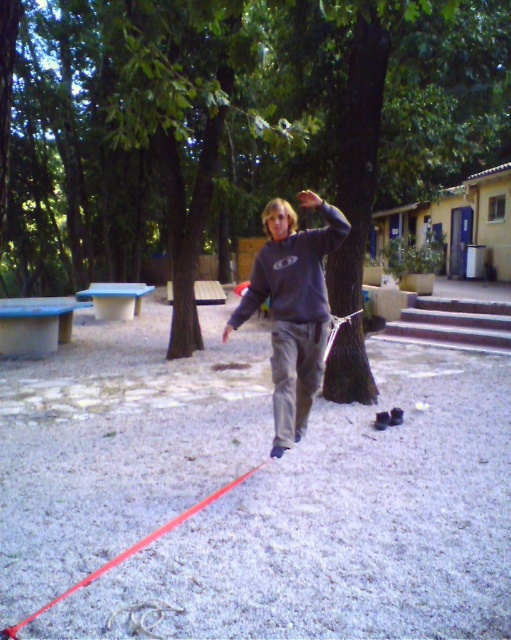
Between dark gray sweatshirt at center and matte gray sweatshirt at center, which one has more height?

With more height is dark gray sweatshirt at center.

Is dark gray sweatshirt at center wider than matte gray sweatshirt at center?

No.

Between point (303, 198) and point (268, 257), which one is positioned behind?

Point (268, 257)

Identify the location of dark gray sweatshirt at center. coord(292,308).

Between green leafy tree at center and dark gray sweatshirt at center, which one appears on the right side from the viewer's perspective?

Positioned to the right is dark gray sweatshirt at center.

Between green leafy tree at center and dark gray sweatshirt at center, which one appears on the left side from the viewer's perspective?

From the viewer's perspective, green leafy tree at center appears more on the left side.

Which is behind, point (141, 97) or point (294, 284)?

Point (141, 97)

Find the location of a particular element. green leafy tree at center is located at coordinates (233, 124).

Does green leafy tree at center have a larger size compared to matte gray sweatshirt at center?

Yes, green leafy tree at center is bigger than matte gray sweatshirt at center.

Is point (65, 202) positioned in front of point (324, 216)?

No.

Locate an element on the screen. green leafy tree at center is located at coordinates (233, 124).